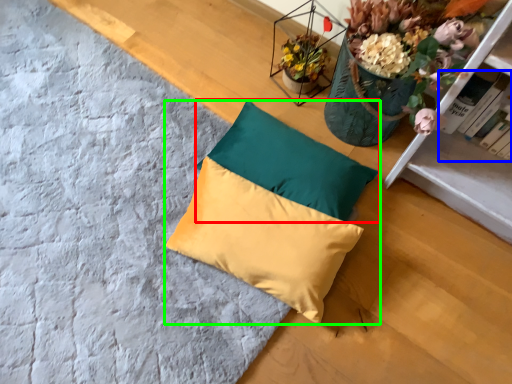
Question: Which object is the closest to the pillow (highlighted by a red box)? Choose among these: book (highlighted by a blue box) or pillow (highlighted by a green box).

Choices:
 (A) book
 (B) pillow

Answer: (B)